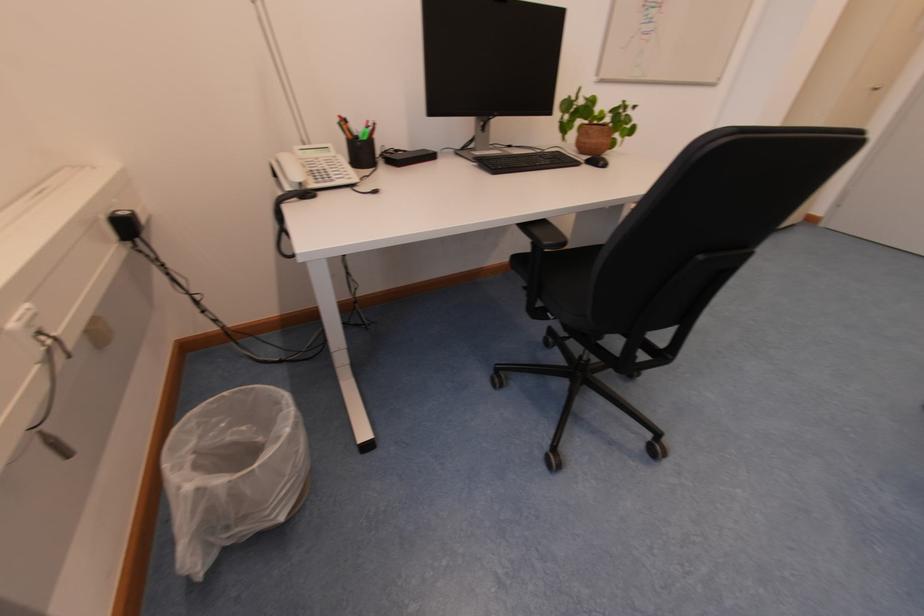
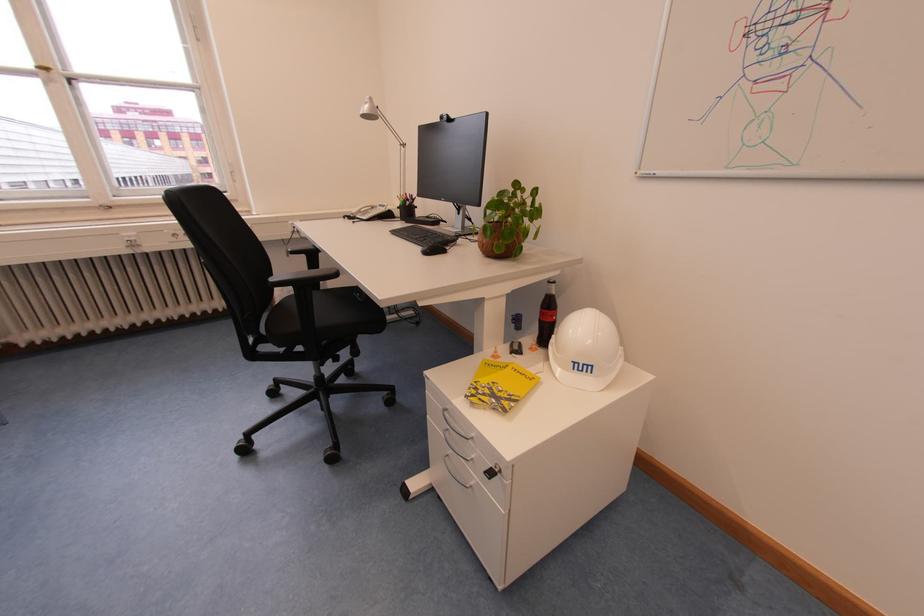
Locate, in the second image, the point that corresponds to (588,92) in the first image.

(524, 187)